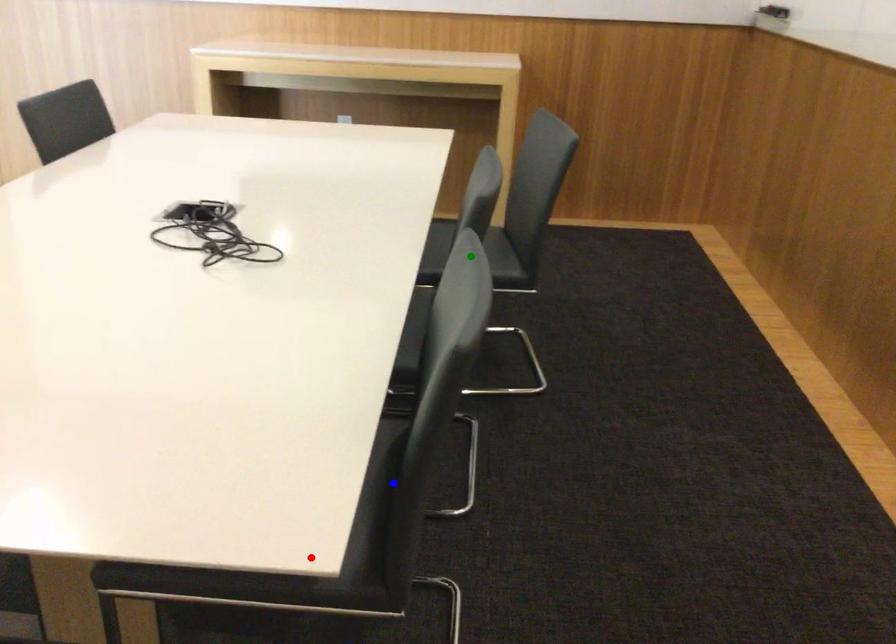
In the scene shown: Order these from nearest to farthest:
green point | red point | blue point

red point, blue point, green point